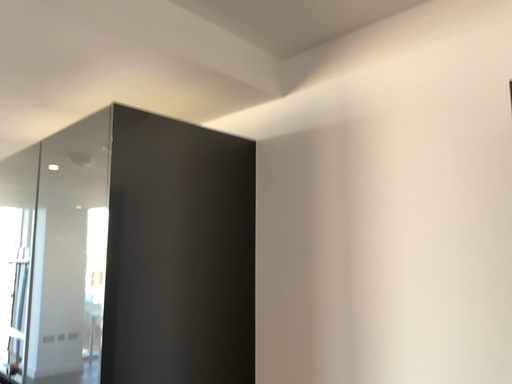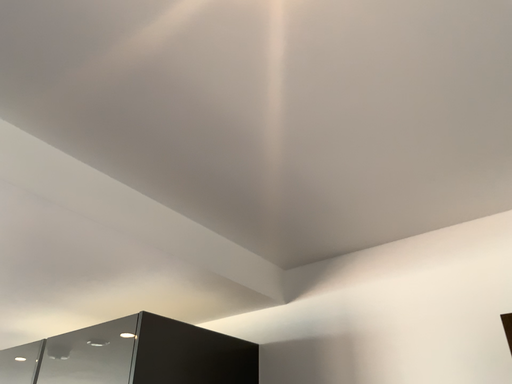
Question: Which way did the camera rotate in the video?

Choices:
 (A) rotated left
 (B) rotated right

Answer: (B)